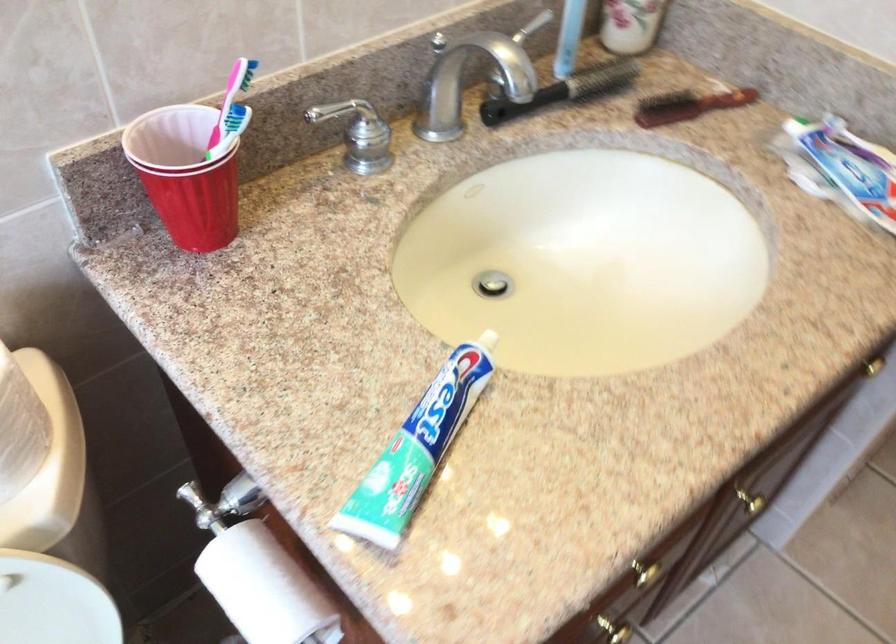
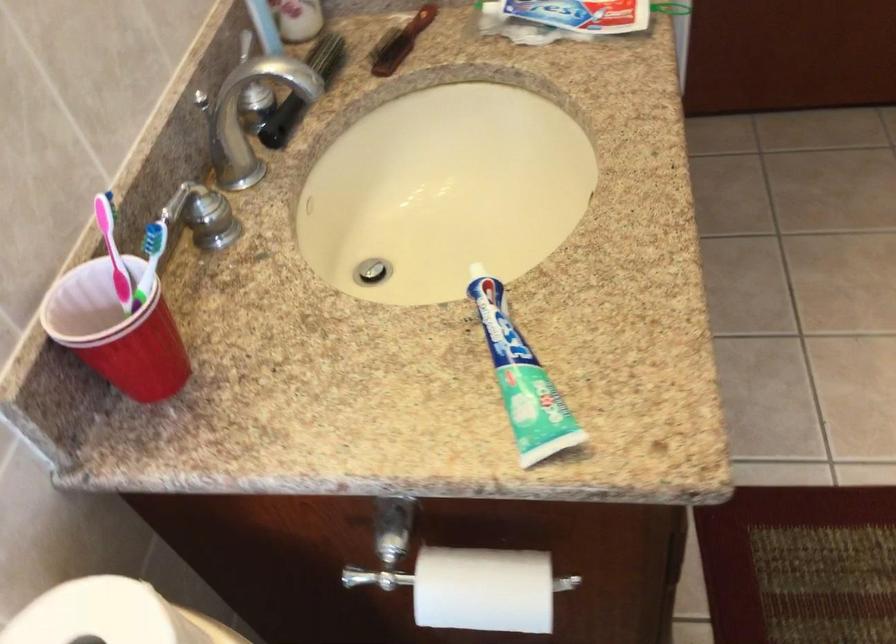
Where in the second image is the point corresponding to point (164, 169) from the first image?

(116, 330)